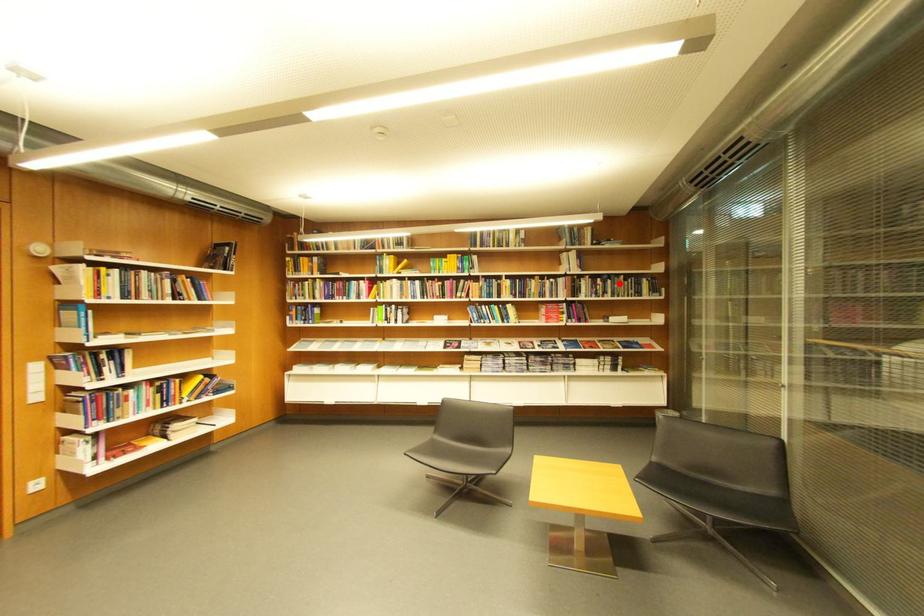
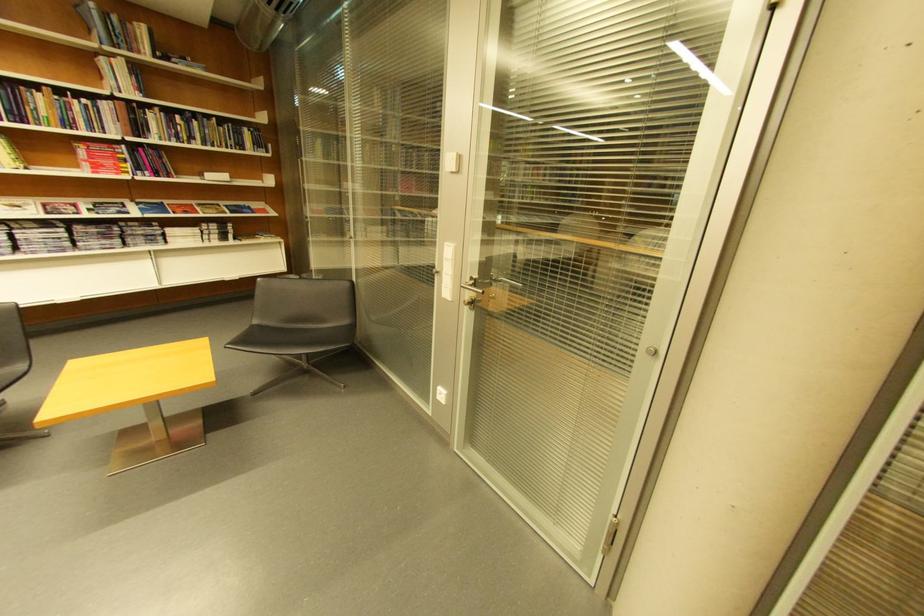
The point at the highlighted location is marked in the first image. Where is the corresponding point in the second image?

(205, 124)